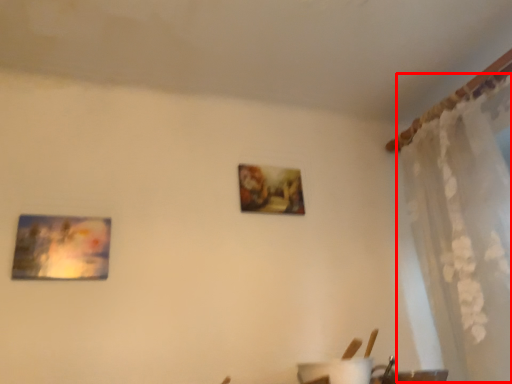
Question: Considering the relative positions of curtain (annotated by the red box) and picture frame in the image provided, where is curtain (annotated by the red box) located with respect to the staircase?

Choices:
 (A) left
 (B) right

Answer: (B)